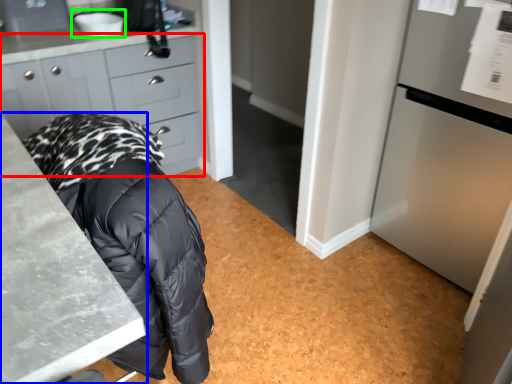
Question: Which object is positioned closest to cabinetry (highlighted by a red box)? Select from countertop (highlighted by a blue box) and sink (highlighted by a green box).

Choices:
 (A) countertop
 (B) sink

Answer: (B)